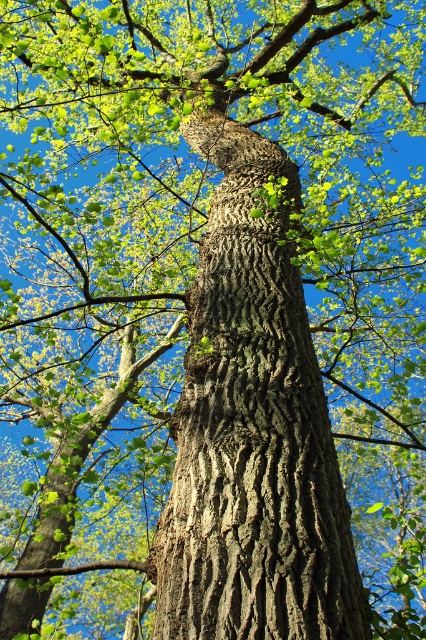
You are a bird looking for a place to perch. You see the dark brown textured bark at center and the green matte branch at lower left. Which one is higher up in the tree?

The dark brown textured bark at center is located above the green matte branch at lower left, so it is higher up in the tree.

You are a botanist examining the tree trunk and its branches. Which object occupies more space in the image, the dark brown textured bark at center or the green matte branch at lower left?

The dark brown textured bark at center has a larger size compared to the green matte branch at lower left, so it occupies more space in the image.

You are standing 6 feet away from the tree trunk. If you want to touch the point at coordinate point (322, 627) on the tree, will you be able to reach it without moving closer?

The distance of point (322, 627) from viewer is 5.68 feet, so yes, you can reach it without moving closer since you are already 6 feet away which is slightly farther than the point.